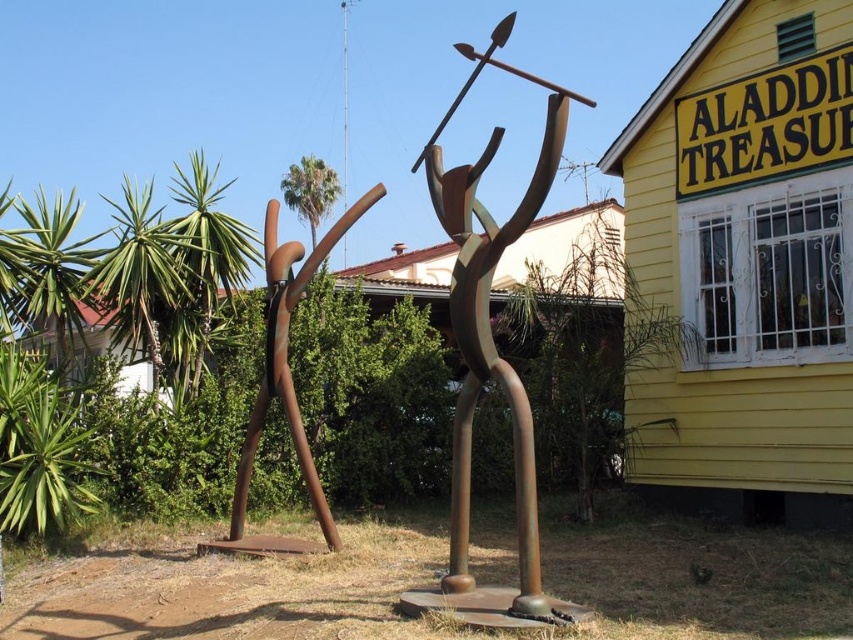
Question: Which point is farther to the camera?

Choices:
 (A) (474, 586)
 (B) (247, 502)

Answer: (B)

Question: Which point is closer to the camera?

Choices:
 (A) (485, 348)
 (B) (287, 416)

Answer: (A)

Question: Is rusty metal figure at center thinner than rusty metal sculpture at center?

Choices:
 (A) yes
 (B) no

Answer: (A)

Question: Does rusty metal figure at center appear under rusty metal sculpture at center?

Choices:
 (A) yes
 (B) no

Answer: (B)

Question: Is rusty metal figure at center above rusty metal sculpture at center?

Choices:
 (A) no
 (B) yes

Answer: (B)